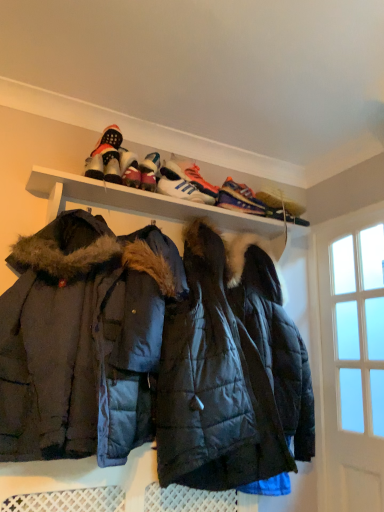
Image resolution: width=384 pixels, height=512 pixels. What are the coordinates of `vacant area situated to the left side of white leather sneaker at upper center, which is the 1th footwear from left to right` in the screenshot? It's located at (72, 182).